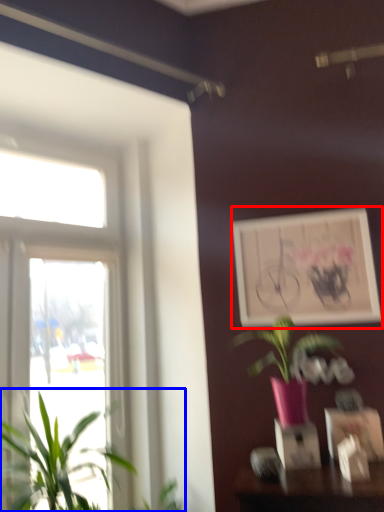
Question: Which of the following is the closest to the observer, picture frame (highlighted by a red box) or houseplant (highlighted by a blue box)?

Choices:
 (A) picture frame
 (B) houseplant

Answer: (B)